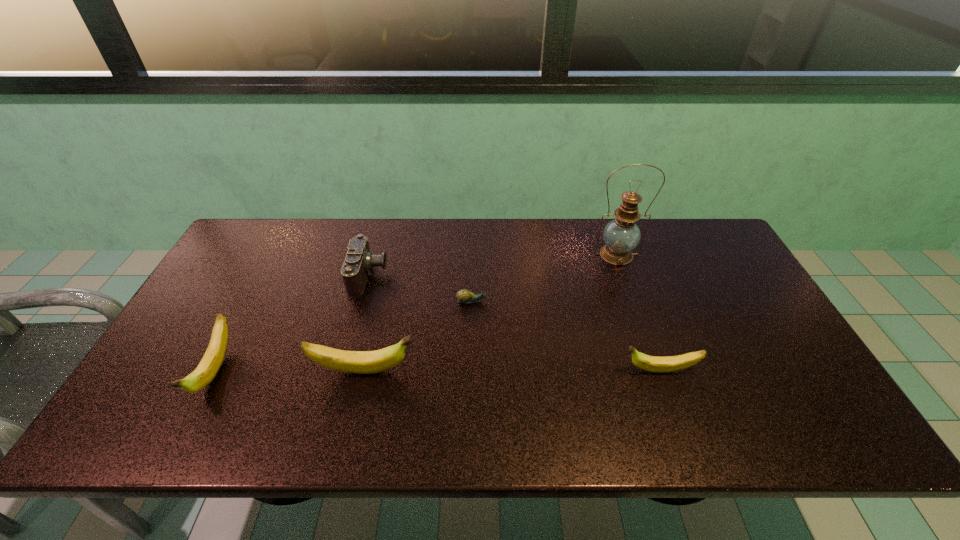
You are a GUI agent. You are given a task and a screenshot of the screen. Output one action in this format:
    pyautogui.click(x=<x>, y=<y>)
    Task: Click on the free spot located at the stem of the rightmost banana
    The width and height of the screenshot is (960, 540).
    Given the screenshot: What is the action you would take?
    pos(545,370)

In order to click on vacant point located at the stem of the rightmost banana in this screenshot , I will do `click(468, 370)`.

Image resolution: width=960 pixels, height=540 pixels. Identify the location of free space located on the left of the oil lamp. (529, 255).

The height and width of the screenshot is (540, 960). What are the coordinates of `free space located 0.200m on the front-facing side of the camera` in the screenshot? It's located at (452, 275).

Locate an element on the screen. free region located 0.180m on the front-facing side of the third object from right to left is located at coordinates (551, 301).

This screenshot has width=960, height=540. What are the coordinates of `oil lamp present at the far edge` in the screenshot? It's located at (621, 235).

Identify the location of camera present at the far edge. This screenshot has height=540, width=960. (359, 260).

Identify the location of object situated at the left edge. (210, 364).

You are a GUI agent. You are given a task and a screenshot of the screen. Output one action in this format:
    pyautogui.click(x=<x>, y=<y>)
    Task: Click on the object that is positioned at the near left corner
    
    Given the screenshot: What is the action you would take?
    pyautogui.click(x=210, y=364)

The width and height of the screenshot is (960, 540). I want to click on blank space at the far edge, so point(343,261).